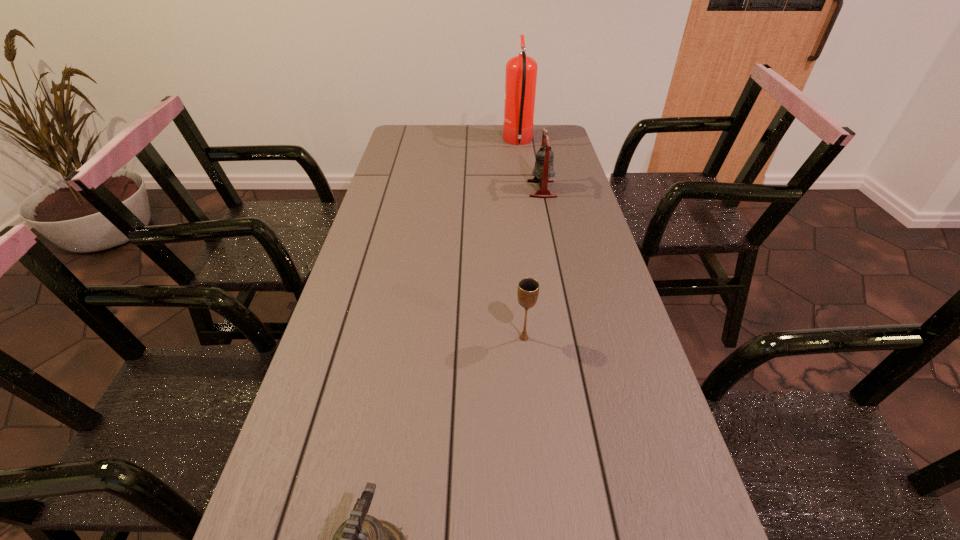
Locate an element on the screen. This screenshot has height=540, width=960. free space that satisfies the following two spatial constraints: 1. on the back side of the third shortest object; 2. towards the nozzle of the farthest object is located at coordinates (532, 143).

Where is `vacant space that satisfies the following two spatial constraints: 1. towards the nozzle of the right bell; 2. on the right side of the tallest object`? The height and width of the screenshot is (540, 960). vacant space that satisfies the following two spatial constraints: 1. towards the nozzle of the right bell; 2. on the right side of the tallest object is located at coordinates (525, 189).

Locate an element on the screen. vacant space that satisfies the following two spatial constraints: 1. on the back side of the chalice; 2. on the left side of the farther bell is located at coordinates (509, 189).

Identify the location of free spot that satisfies the following two spatial constraints: 1. towards the nozzle of the farther bell; 2. on the left side of the fire extinguisher. (525, 189).